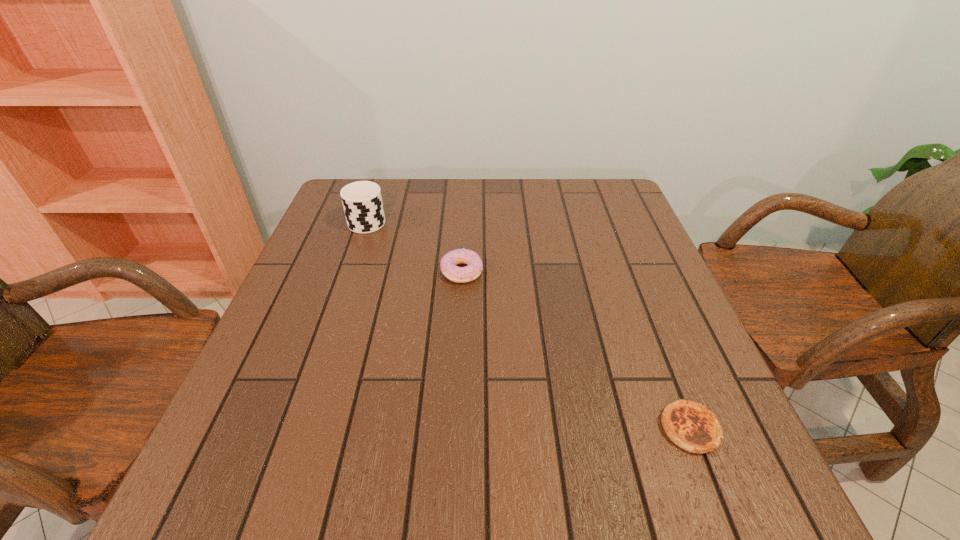
This screenshot has width=960, height=540. I want to click on free point between the tallest object and the second nearest object, so click(415, 246).

Locate an element on the screen. empty space between the second tallest object and the rightmost object is located at coordinates (576, 350).

The image size is (960, 540). Find the location of `free spot between the farthest object and the rightmost object`. free spot between the farthest object and the rightmost object is located at coordinates (529, 324).

This screenshot has height=540, width=960. Identify the location of free spot between the second object from right to left and the tallest object. (415, 246).

The height and width of the screenshot is (540, 960). Find the location of `vacant space that is in between the tallest object and the shortest object`. vacant space that is in between the tallest object and the shortest object is located at coordinates (529, 324).

Identify the location of vacant point located between the rightmost object and the cup. (529, 324).

Identify the location of vacant area between the quiche and the cup. (529, 324).

You are a GUI agent. You are given a task and a screenshot of the screen. Output one action in this format:
    pyautogui.click(x=<x>, y=<y>)
    Task: Click on the free point between the quiche and the doughnut
    Image resolution: width=960 pixels, height=540 pixels.
    Given the screenshot: What is the action you would take?
    pyautogui.click(x=576, y=350)

Locate an element on the screen. free space that is in between the shortest object and the second shortest object is located at coordinates pyautogui.click(x=576, y=350).

Locate an element on the screen. vacant area that lies between the shortest object and the tallest object is located at coordinates [x=529, y=324].